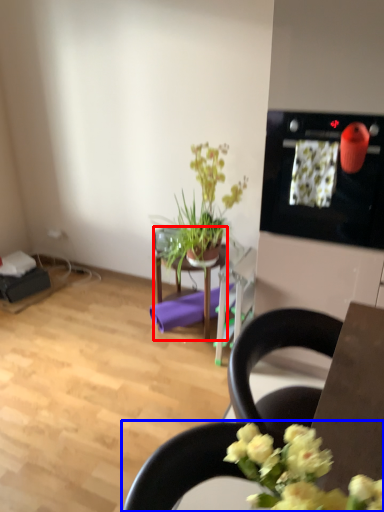
Question: Which point is closer to the camera, table (highlighted by a red box) or chair (highlighted by a blue box)?

Choices:
 (A) table
 (B) chair

Answer: (B)